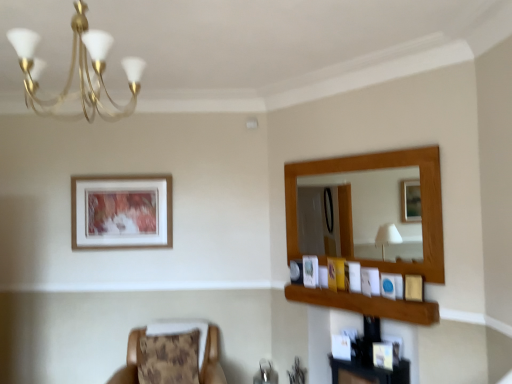
I want to click on wooden picture frame at upper right, positioned as the fourth picture frame in right-to-left order, so click(310, 271).

Based on the photo, what is the approximate width of matte blue picture frame at upper right, arranged as the second picture frame when viewed from the right?

The width of matte blue picture frame at upper right, arranged as the second picture frame when viewed from the right, is 1.67 inches.

Consider the image. What is the approximate height of matte blue picture frame at upper right, acting as the 5th picture frame starting from the left?

The height of matte blue picture frame at upper right, acting as the 5th picture frame starting from the left, is 16.31 centimeters.

This screenshot has width=512, height=384. Find the location of `matte gold picture frame at right, marked as the 6th picture frame in a back-to-front arrangement`. matte gold picture frame at right, marked as the 6th picture frame in a back-to-front arrangement is located at coordinates pyautogui.click(x=414, y=288).

Where is `matte white picture frame at upper center, the fifth picture frame positioned from the front`? This screenshot has width=512, height=384. matte white picture frame at upper center, the fifth picture frame positioned from the front is located at coordinates 296,271.

Where is `wooden frame at upper right`? wooden frame at upper right is located at coordinates (366, 304).

Choose the correct answer: Is matte white picture frame at upper center, which is the 2th picture frame in left-to-right order, inside wooden picture frame at upper right, placed as the 4th picture frame when sorted from front to back, or outside it?

The correct answer is: outside.

In terms of height, does matte white picture frame at upper center, placed as the fifth picture frame when sorted from right to left, look taller or shorter compared to wooden picture frame at upper right, positioned as the fourth picture frame in right-to-left order?

Considering their sizes, matte white picture frame at upper center, placed as the fifth picture frame when sorted from right to left, has less height than wooden picture frame at upper right, positioned as the fourth picture frame in right-to-left order.

Is matte white picture frame at upper center, which is counted as the second picture frame, starting from the back, turned away from wooden picture frame at upper right, which is counted as the third picture frame, starting from the left?

No, matte white picture frame at upper center, which is counted as the second picture frame, starting from the back,'s orientation is not away from wooden picture frame at upper right, which is counted as the third picture frame, starting from the left.

From the picture: How many degrees apart are the facing directions of brown textured cushion at lower left and wooden framed artwork at upper left, positioned as the 1th picture frame in back-to-front order?

brown textured cushion at lower left and wooden framed artwork at upper left, positioned as the 1th picture frame in back-to-front order, are facing 5.51 degrees away from each other.

Can you confirm if brown textured cushion at lower left is wider than wooden framed artwork at upper left, which appears as the 6th picture frame when viewed from the right?

Yes.

Which object is positioned more to the right, brown textured cushion at lower left or wooden framed artwork at upper left, which appears as the 6th picture frame when viewed from the right?

brown textured cushion at lower left is more to the right.

Considering the sizes of objects brown textured cushion at lower left and wooden framed artwork at upper left, acting as the first picture frame starting from the left, in the image provided, who is taller, brown textured cushion at lower left or wooden framed artwork at upper left, acting as the first picture frame starting from the left,?

Standing taller between the two is wooden framed artwork at upper left, acting as the first picture frame starting from the left.

Does wooden frame at upper right come behind wooden framed artwork at upper left, positioned as the 1th picture frame in back-to-front order?

No, the depth of wooden frame at upper right is less than that of wooden framed artwork at upper left, positioned as the 1th picture frame in back-to-front order.

Can you confirm if wooden frame at upper right is shorter than wooden framed artwork at upper left, which appears as the 6th picture frame when viewed from the right?

Correct, wooden frame at upper right is not as tall as wooden framed artwork at upper left, which appears as the 6th picture frame when viewed from the right.

Is wooden frame at upper right facing away from wooden framed artwork at upper left, positioned as the 1th picture frame in back-to-front order?

No, wooden frame at upper right is not facing the opposite direction of wooden framed artwork at upper left, positioned as the 1th picture frame in back-to-front order.

Would you consider wooden frame at upper right to be distant from wooden framed artwork at upper left, positioned as the 1th picture frame in back-to-front order?

Yes, wooden frame at upper right and wooden framed artwork at upper left, positioned as the 1th picture frame in back-to-front order, are located far from each other.

Looking at the image, does matte white picture frame at upper center, placed as the fifth picture frame when sorted from right to left, seem bigger or smaller compared to gold metallic chandelier at upper left?

Considering their sizes, matte white picture frame at upper center, placed as the fifth picture frame when sorted from right to left, takes up less space than gold metallic chandelier at upper left.

Is matte white picture frame at upper center, the fifth picture frame positioned from the front, wider or thinner than gold metallic chandelier at upper left?

matte white picture frame at upper center, the fifth picture frame positioned from the front, is thinner than gold metallic chandelier at upper left.

Which object is positioned more to the right, matte white picture frame at upper center, the fifth picture frame positioned from the front, or gold metallic chandelier at upper left?

matte white picture frame at upper center, the fifth picture frame positioned from the front, is more to the right.

Which is in front, point (292, 265) or point (103, 110)?

Positioned in front is point (103, 110).

Considering the relative sizes of wooden picture frame at right, marked as the fourth picture frame in a left-to-right arrangement, and wooden frame at upper right in the image provided, is wooden picture frame at right, marked as the fourth picture frame in a left-to-right arrangement, taller than wooden frame at upper right?

Yes, wooden picture frame at right, marked as the fourth picture frame in a left-to-right arrangement, is taller than wooden frame at upper right.

Does point (365, 277) come closer to viewer compared to point (360, 311)?

No, it is not.

From a real-world perspective, between wooden picture frame at right, arranged as the 3th picture frame when viewed from the front, and wooden frame at upper right, who is vertically lower?

wooden frame at upper right.

Could wooden framed artwork at upper left, which is counted as the sixth picture frame, starting from the front, be considered to be inside matte white picture frame at upper center, the fifth picture frame positioned from the front?

No.

From the picture: Who is smaller, matte white picture frame at upper center, the fifth picture frame positioned from the front, or wooden framed artwork at upper left, which is counted as the sixth picture frame, starting from the front?

Smaller between the two is matte white picture frame at upper center, the fifth picture frame positioned from the front.

Can you confirm if matte white picture frame at upper center, which is counted as the second picture frame, starting from the back, is positioned to the right of wooden framed artwork at upper left, acting as the first picture frame starting from the left?

Indeed, matte white picture frame at upper center, which is counted as the second picture frame, starting from the back, is positioned on the right side of wooden framed artwork at upper left, acting as the first picture frame starting from the left.

Could you measure the distance between matte white picture frame at upper center, placed as the fifth picture frame when sorted from right to left, and wooden framed artwork at upper left, which is counted as the sixth picture frame, starting from the front?

They are 1.54 meters apart.

Is there a large distance between matte blue picture frame at upper right, arranged as the second picture frame when viewed from the right, and matte gold picture frame at right, the sixth picture frame viewed from the left?

matte blue picture frame at upper right, arranged as the second picture frame when viewed from the right, is near matte gold picture frame at right, the sixth picture frame viewed from the left, not far away.

From a real-world perspective, does matte blue picture frame at upper right, the fifth picture frame positioned from the back, sit lower than matte gold picture frame at right, arranged as the 1th picture frame when viewed from the front?

Yes.

Is matte blue picture frame at upper right, the fifth picture frame positioned from the back, bigger or smaller than matte gold picture frame at right, which is the 1th picture frame from right to left?

In the image, matte blue picture frame at upper right, the fifth picture frame positioned from the back, appears to be smaller than matte gold picture frame at right, which is the 1th picture frame from right to left.

Could you tell me if matte blue picture frame at upper right, acting as the 5th picture frame starting from the left, is turned towards matte gold picture frame at right, arranged as the 1th picture frame when viewed from the front?

No.

Find the location of a particular element. the 1st picture frame in front of the matte white picture frame at upper center, which is counted as the second picture frame, starting from the back is located at coordinates (310, 271).

There is a brown textured cushion at lower left. Where is `the 6th picture frame above it (from the image's perspective)`? The width and height of the screenshot is (512, 384). the 6th picture frame above it (from the image's perspective) is located at coordinates 121,211.

When comparing their distances from wooden picture frame at right, arranged as the 3th picture frame when viewed from the front, does wooden frame at upper right or matte blue picture frame at upper right, acting as the 5th picture frame starting from the left, seem further?

The object further to wooden picture frame at right, arranged as the 3th picture frame when viewed from the front, is wooden frame at upper right.

Which object lies further to the anchor point wooden picture frame at upper right, the 3th picture frame when ordered from back to front, gold metallic chandelier at upper left or matte blue picture frame at upper right, the fifth picture frame positioned from the back?

gold metallic chandelier at upper left is positioned further to the anchor wooden picture frame at upper right, the 3th picture frame when ordered from back to front.

Estimate the real-world distances between objects in this image. Which object is further from matte blue picture frame at upper right, arranged as the second picture frame when viewed from the right, wooden picture frame at right, arranged as the 3th picture frame when viewed from the front, or wooden framed artwork at upper left, positioned as the 1th picture frame in back-to-front order?

The object further to matte blue picture frame at upper right, arranged as the second picture frame when viewed from the right, is wooden framed artwork at upper left, positioned as the 1th picture frame in back-to-front order.

Looking at the image, which one is located further to matte blue picture frame at upper right, arranged as the second picture frame when viewed from the right, gold metallic chandelier at upper left or matte gold picture frame at right, the sixth picture frame viewed from the left?

Among the two, gold metallic chandelier at upper left is located further to matte blue picture frame at upper right, arranged as the second picture frame when viewed from the right.

Estimate the real-world distances between objects in this image. Which object is further from wooden frame at upper right, matte gold picture frame at right, marked as the 6th picture frame in a back-to-front arrangement, or brown textured cushion at lower left?

Among the two, brown textured cushion at lower left is located further to wooden frame at upper right.

From the image, which object appears to be nearer to matte gold picture frame at right, which is the 1th picture frame from right to left, matte white picture frame at upper center, the fifth picture frame positioned from the front, or brown textured cushion at lower left?

matte white picture frame at upper center, the fifth picture frame positioned from the front, is positioned closer to the anchor matte gold picture frame at right, which is the 1th picture frame from right to left.

From the image, which object appears to be nearer to wooden picture frame at right, marked as the fourth picture frame in a left-to-right arrangement, matte blue picture frame at upper right, the fifth picture frame positioned from the back, or brown textured cushion at lower left?

matte blue picture frame at upper right, the fifth picture frame positioned from the back, is closer to wooden picture frame at right, marked as the fourth picture frame in a left-to-right arrangement.

Considering their positions, is gold metallic chandelier at upper left positioned closer to wooden framed artwork at upper left, which is counted as the sixth picture frame, starting from the front, than matte blue picture frame at upper right, the 2th picture frame from the front?

gold metallic chandelier at upper left is closer to wooden framed artwork at upper left, which is counted as the sixth picture frame, starting from the front.

Identify the location of chair between gold metallic chandelier at upper left and matte white picture frame at upper center, which is the 2th picture frame in left-to-right order, along the z-axis. (172, 362).

Where is `chair between wooden framed artwork at upper left, acting as the first picture frame starting from the left, and wooden picture frame at upper right, which is counted as the third picture frame, starting from the left`? The width and height of the screenshot is (512, 384). chair between wooden framed artwork at upper left, acting as the first picture frame starting from the left, and wooden picture frame at upper right, which is counted as the third picture frame, starting from the left is located at coordinates (172, 362).

Image resolution: width=512 pixels, height=384 pixels. In order to click on balustrade between brown textured cushion at lower left and wooden picture frame at right, arranged as the 3th picture frame when viewed from the front, in the horizontal direction in this screenshot , I will do `click(366, 304)`.

At what (x,y) coordinates should I click in order to perform the action: click on picture frame between wooden picture frame at right, marked as the fourth picture frame in a left-to-right arrangement, and matte white picture frame at upper center, the fifth picture frame positioned from the front, from front to back. Please return your answer as a coordinate pair (x, y). The image size is (512, 384). Looking at the image, I should click on (310, 271).